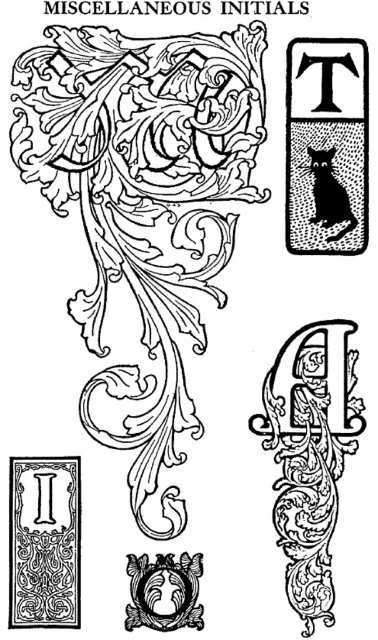
Which is more to the left, matte black ornate letter a at center or black ornate letter at lower left?

black ornate letter at lower left

The width and height of the screenshot is (378, 640). What are the coordinates of `matte black ornate letter a at center` in the screenshot? It's located at (309, 454).

Which is below, black ink swirls at upper left or matte black ornate letter a at center?

matte black ornate letter a at center is below.

Who is more forward, (244,115) or (323,556)?

Point (323,556)

Locate an element on the screen. This screenshot has width=378, height=640. black ink swirls at upper left is located at coordinates (145, 198).

Can you confirm if black ink swirls at upper left is taller than black dotted cat at upper right?

Correct, black ink swirls at upper left is much taller as black dotted cat at upper right.

Is point (184, 328) less distant than point (367, 67)?

Yes, it is.

What are the coordinates of `black ink swirls at upper left` in the screenshot? It's located at click(x=145, y=198).